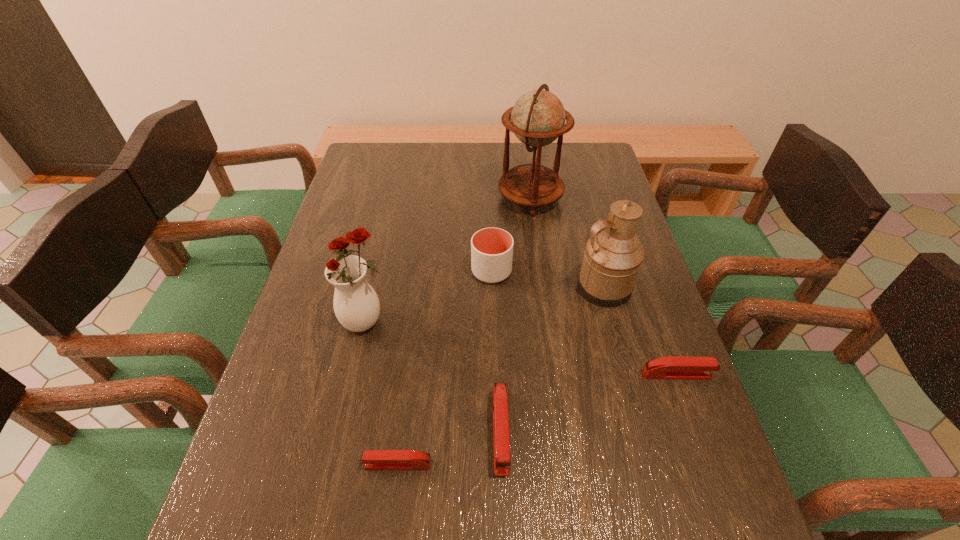
You are a GUI agent. You are given a task and a screenshot of the screen. Output one action in this format:
    pyautogui.click(x=<x>, y=<y>)
    Task: Click on the blank area in the image that satisfies the following two spatial constraints: 1. on the surface of the tallest object; 2. on the front-facing side of the second stapler from right to left
    Image resolution: width=960 pixels, height=540 pixels.
    Given the screenshot: What is the action you would take?
    pyautogui.click(x=562, y=431)